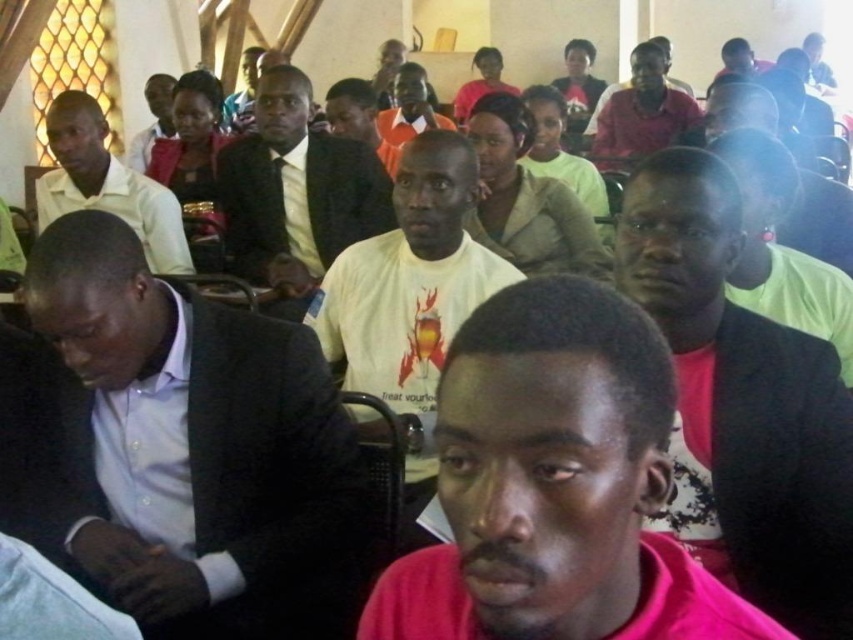
You are organizing a photo shoot and need to ensure that all participants are visible in the frame. Given that the light blue shirt at center and the matte red shirt at upper center are part of the group, which of these two shirts takes up more space in the current composition?

The matte red shirt at upper center occupies more space than the light blue shirt at center in the current composition.